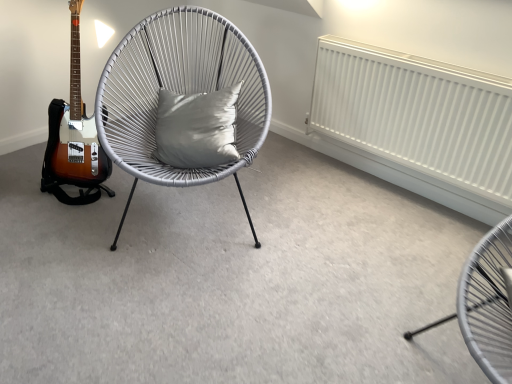
Find the location of a particular element. This screenshot has height=384, width=512. white woven chair at center, acting as the second chair starting from the right is located at coordinates (180, 92).

Locate an element on the screen. matte grey chair at lower right, which is the first chair from front to back is located at coordinates (486, 303).

What do you see at coordinates (197, 128) in the screenshot? I see `satin gray cushion at center` at bounding box center [197, 128].

The width and height of the screenshot is (512, 384). Find the location of `white matte radiator at upper right`. white matte radiator at upper right is located at coordinates (417, 117).

Is white woven chair at center, which is the first chair in back-to-front order, not within satin gray cushion at center?

Absolutely, white woven chair at center, which is the first chair in back-to-front order, is external to satin gray cushion at center.

Considering the sizes of objects white woven chair at center, the first chair viewed from the left, and satin gray cushion at center in the image provided, who is shorter, white woven chair at center, the first chair viewed from the left, or satin gray cushion at center?

Standing shorter between the two is satin gray cushion at center.

Is white woven chair at center, the second chair when ordered from front to back, positioned behind satin gray cushion at center?

No, white woven chair at center, the second chair when ordered from front to back, is closer to the viewer.

From a real-world perspective, relative to white matte radiator at upper right, is white woven chair at center, the second chair when ordered from front to back, vertically above or below?

Clearly, from a real-world perspective, white woven chair at center, the second chair when ordered from front to back, is above white matte radiator at upper right.

Is white woven chair at center, the first chair viewed from the left, at the left side of white matte radiator at upper right?

Correct, you'll find white woven chair at center, the first chair viewed from the left, to the left of white matte radiator at upper right.

Is the surface of white woven chair at center, the first chair viewed from the left, in direct contact with white matte radiator at upper right?

No, white woven chair at center, the first chair viewed from the left, is not making contact with white matte radiator at upper right.

Would you say white matte radiator at upper right is part of white woven chair at center, which is the first chair in back-to-front order,'s contents?

No, white matte radiator at upper right is not inside white woven chair at center, which is the first chair in back-to-front order.

What's the angular difference between matte grey chair at lower right, which is the first chair from front to back, and satin gray cushion at center's facing directions?

There is a 76.1-degree angle between the facing directions of matte grey chair at lower right, which is the first chair from front to back, and satin gray cushion at center.

Considering the positions of objects matte grey chair at lower right, the 1th chair positioned from the right, and satin gray cushion at center in the image provided, who is more to the right, matte grey chair at lower right, the 1th chair positioned from the right, or satin gray cushion at center?

From the viewer's perspective, matte grey chair at lower right, the 1th chair positioned from the right, appears more on the right side.

Can we say matte grey chair at lower right, placed as the second chair when sorted from back to front, lies outside satin gray cushion at center?

Yes, matte grey chair at lower right, placed as the second chair when sorted from back to front, is outside of satin gray cushion at center.

Which object is wider, matte grey chair at lower right, the 1th chair positioned from the right, or satin gray cushion at center?

matte grey chair at lower right, the 1th chair positioned from the right.

Is white matte radiator at upper right a part of matte grey chair at lower right, which is the 2th chair from left to right?

No, white matte radiator at upper right is not surrounded by matte grey chair at lower right, which is the 2th chair from left to right.

Which is more to the left, matte grey chair at lower right, the 1th chair positioned from the right, or white matte radiator at upper right?

Positioned to the left is white matte radiator at upper right.

From the image's perspective, count 2nd chairs downward from the white matte radiator at upper right and point to it. Please provide its 2D coordinates.

[(486, 303)]

Does matte grey chair at lower right, the 1th chair positioned from the right, turn towards white matte radiator at upper right?

No, matte grey chair at lower right, the 1th chair positioned from the right, is not turned towards white matte radiator at upper right.

Measure the distance between satin gray cushion at center and white matte radiator at upper right.

33.30 inches.

Which object is thinner, satin gray cushion at center or white matte radiator at upper right?

white matte radiator at upper right.

From the image's perspective, which one is positioned lower, satin gray cushion at center or white matte radiator at upper right?

satin gray cushion at center.

Considering the points (197, 164) and (352, 133), which point is in front, point (197, 164) or point (352, 133)?

The point (197, 164) is in front.

How distant is white matte radiator at upper right from white woven chair at center, the first chair viewed from the left?

The distance of white matte radiator at upper right from white woven chair at center, the first chair viewed from the left, is 77.93 centimeters.

Could you tell me if white matte radiator at upper right is facing white woven chair at center, the first chair viewed from the left?

Yes, white matte radiator at upper right is oriented towards white woven chair at center, the first chair viewed from the left.

Can white woven chair at center, which is the first chair in back-to-front order, be found inside white matte radiator at upper right?

No, white matte radiator at upper right does not contain white woven chair at center, which is the first chair in back-to-front order.

From a real-world perspective, is white matte radiator at upper right above or below white woven chair at center, the second chair when ordered from front to back?

white matte radiator at upper right is situated lower than white woven chair at center, the second chair when ordered from front to back, in the real world.

Measure the distance from white woven chair at center, which is the first chair in back-to-front order, to matte grey chair at lower right, the 1th chair positioned from the right.

They are 3.80 feet apart.

Does white woven chair at center, the second chair when ordered from front to back, appear on the right side of matte grey chair at lower right, placed as the second chair when sorted from back to front?

No, white woven chair at center, the second chair when ordered from front to back, is not to the right of matte grey chair at lower right, placed as the second chair when sorted from back to front.

Is white woven chair at center, acting as the second chair starting from the right, next to matte grey chair at lower right, placed as the second chair when sorted from back to front, and touching it?

white woven chair at center, acting as the second chair starting from the right, and matte grey chair at lower right, placed as the second chair when sorted from back to front, are not in contact.

Is matte grey chair at lower right, which is the first chair from front to back, at the back of white woven chair at center, acting as the second chair starting from the right?

No, matte grey chair at lower right, which is the first chair from front to back, is not at the back of white woven chair at center, acting as the second chair starting from the right.

The height and width of the screenshot is (384, 512). In the image, there is a white woven chair at center, the second chair when ordered from front to back. In order to click on pillow below it (from the image's perspective) in this screenshot , I will do `click(197, 128)`.

In the image, there is a white woven chair at center, acting as the second chair starting from the right. Identify the location of radiator above it (from the image's perspective). point(417,117).

From the image, which object appears to be nearer to white matte radiator at upper right, white woven chair at center, which is the first chair in back-to-front order, or matte grey chair at lower right, the 1th chair positioned from the right?

The object closer to white matte radiator at upper right is white woven chair at center, which is the first chair in back-to-front order.

When comparing their distances from matte grey chair at lower right, the 1th chair positioned from the right, does satin gray cushion at center or white matte radiator at upper right seem further?

satin gray cushion at center.

Estimate the real-world distances between objects in this image. Which object is further from white matte radiator at upper right, satin gray cushion at center or white woven chair at center, the first chair viewed from the left?

The object further to white matte radiator at upper right is satin gray cushion at center.

When comparing their distances from white woven chair at center, which is the first chair in back-to-front order, does white matte radiator at upper right or matte grey chair at lower right, placed as the second chair when sorted from back to front, seem further?

The object further to white woven chair at center, which is the first chair in back-to-front order, is matte grey chair at lower right, placed as the second chair when sorted from back to front.

Considering their positions, is white matte radiator at upper right positioned further to matte grey chair at lower right, which is the 2th chair from left to right, than satin gray cushion at center?

satin gray cushion at center is positioned further to the anchor matte grey chair at lower right, which is the 2th chair from left to right.

Consider the image. Looking at the image, which one is located further to white matte radiator at upper right, white woven chair at center, the first chair viewed from the left, or satin gray cushion at center?

satin gray cushion at center lies further to white matte radiator at upper right than the other object.

Estimate the real-world distances between objects in this image. Which object is closer to satin gray cushion at center, white matte radiator at upper right or matte grey chair at lower right, which is the 2th chair from left to right?

white matte radiator at upper right is positioned closer to the anchor satin gray cushion at center.

From the image, which object appears to be nearer to satin gray cushion at center, matte grey chair at lower right, which is the 2th chair from left to right, or white woven chair at center, the second chair when ordered from front to back?

Among the two, white woven chair at center, the second chair when ordered from front to back, is located nearer to satin gray cushion at center.

Find the location of a particular element. The height and width of the screenshot is (384, 512). radiator between satin gray cushion at center and matte grey chair at lower right, which is the first chair from front to back, from left to right is located at coordinates coord(417,117).

The height and width of the screenshot is (384, 512). Identify the location of radiator between white woven chair at center, which is the first chair in back-to-front order, and matte grey chair at lower right, which is the 2th chair from left to right, in the horizontal direction. (417, 117).

The width and height of the screenshot is (512, 384). Identify the location of pillow between white woven chair at center, the first chair viewed from the left, and matte grey chair at lower right, which is the 2th chair from left to right, from left to right. (197, 128).

In order to click on pillow between white woven chair at center, acting as the second chair starting from the right, and white matte radiator at upper right in this screenshot , I will do `click(197, 128)`.